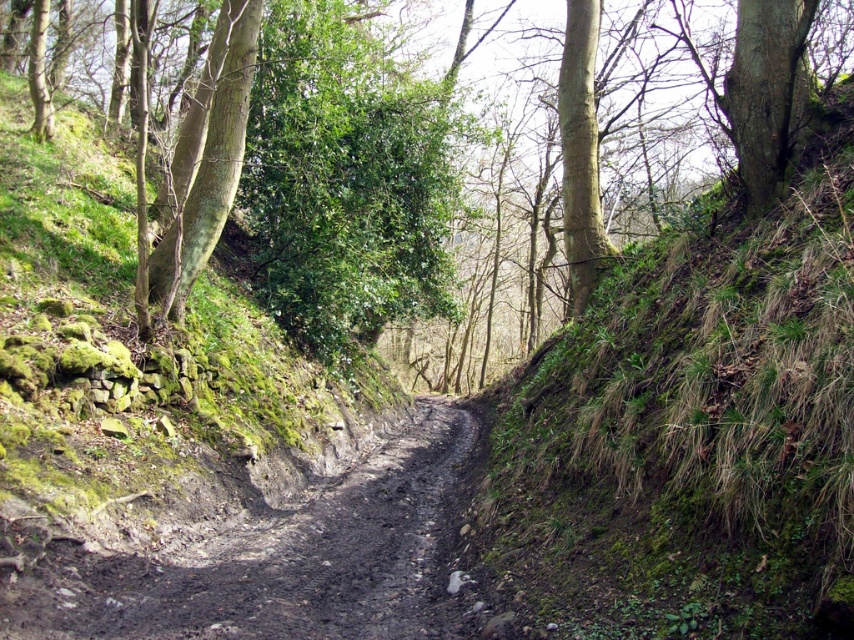
You are standing at the point marked at coordinates (414,272) on a map of the path. You want to walk to the other end of the path, which is 25.75 meters away. If you walk at a speed of 1.5 meters per second, how many seconds will it take you to reach the end?

The distance between the point marked at coordinates (414,272) and the end of the path is 25.75 meters. At a walking speed of 1.5 meters per second, it would take approximately 17.17 seconds to reach the end. Since the question asks for seconds, rounding to the nearest whole number gives about 17 seconds.

You are a hiker trying to decide which tree to tie your rope between for a quick rest. The green leafy tree at center and the smooth bark tree at upper center are options. Which tree has a larger circumference to provide better support?

The green leafy tree at center is wider than the smooth bark tree at upper center, so it has a larger circumference and can provide better support for tying the rope.